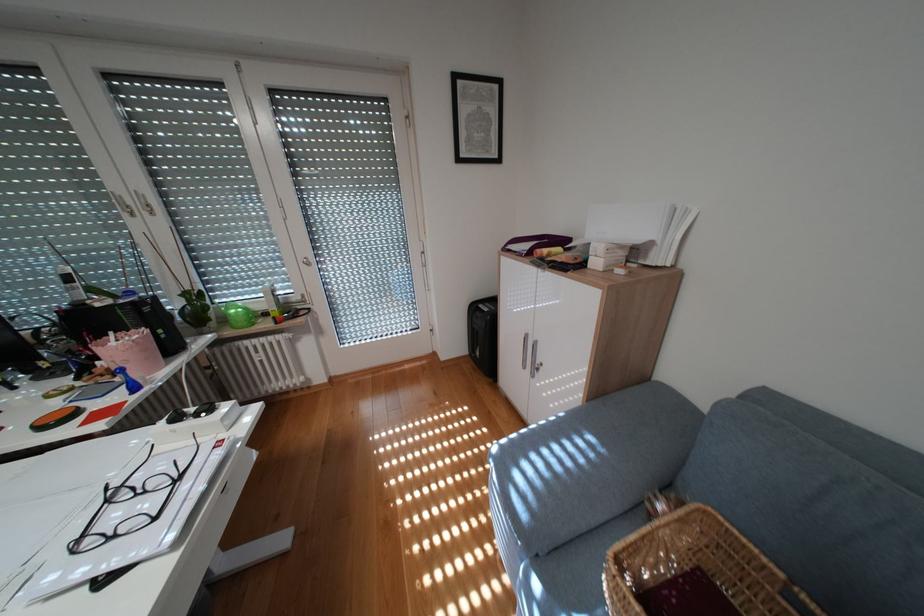
Find where to lift the green glass object. Please return your answer as a coordinate pair (x, y).

(237, 315)